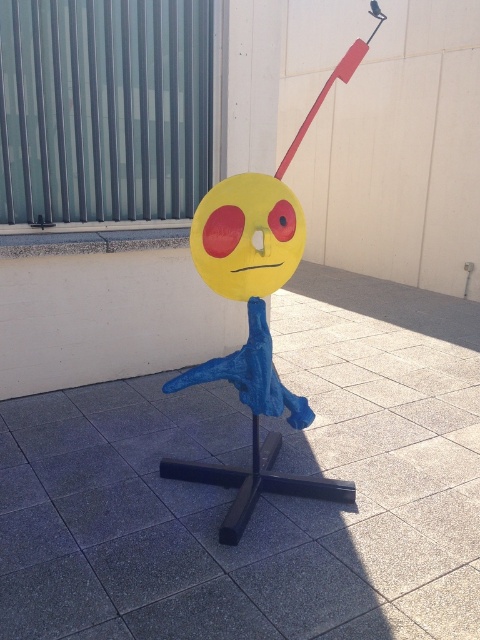
Measure the distance between point (x=269, y=346) and camera.

The distance of point (x=269, y=346) from camera is 7.87 feet.

Where is `yellow matte face at center`? The width and height of the screenshot is (480, 640). yellow matte face at center is located at coordinates (256, 316).

Is point (256, 448) positioned after point (276, 401)?

Yes, it is.

The image size is (480, 640). Identify the location of yellow matte face at center. (256, 316).

Does yellow matte face at center appear on the right side of yellow paper face at center?

Indeed, yellow matte face at center is positioned on the right side of yellow paper face at center.

Does point (248, 362) come farther from viewer compared to point (298, 232)?

Yes, point (248, 362) is farther from viewer.

I want to click on yellow matte face at center, so click(x=256, y=316).

Between point (295, 212) and point (300, 221), which one is positioned behind?

Positioned behind is point (300, 221).

Find the location of a particular element. yellow matte sphere at center is located at coordinates (249, 282).

Find the location of a particular element. This screenshot has height=640, width=480. yellow matte sphere at center is located at coordinates (249, 282).